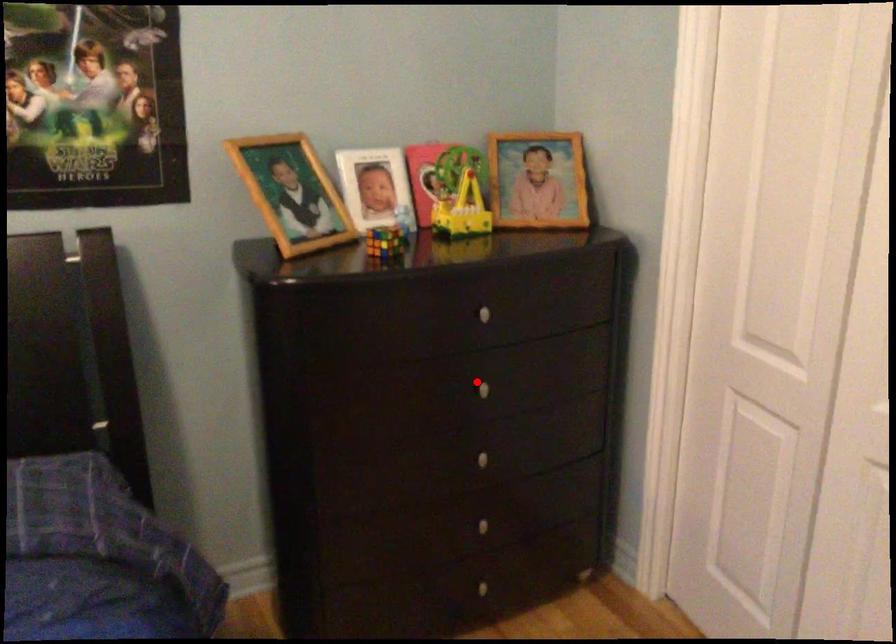
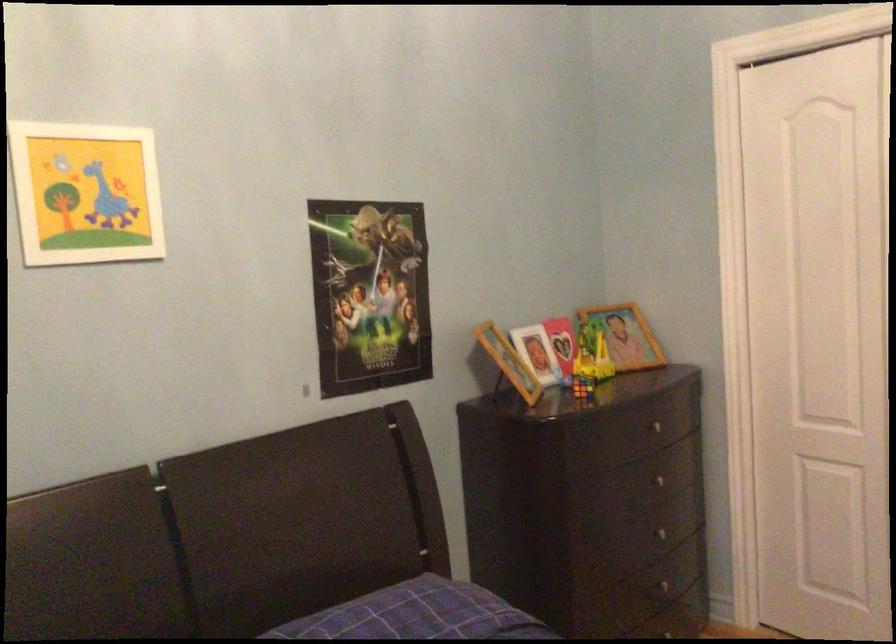
The point at the highlighted location is marked in the first image. Where is the corresponding point in the second image?

(656, 480)